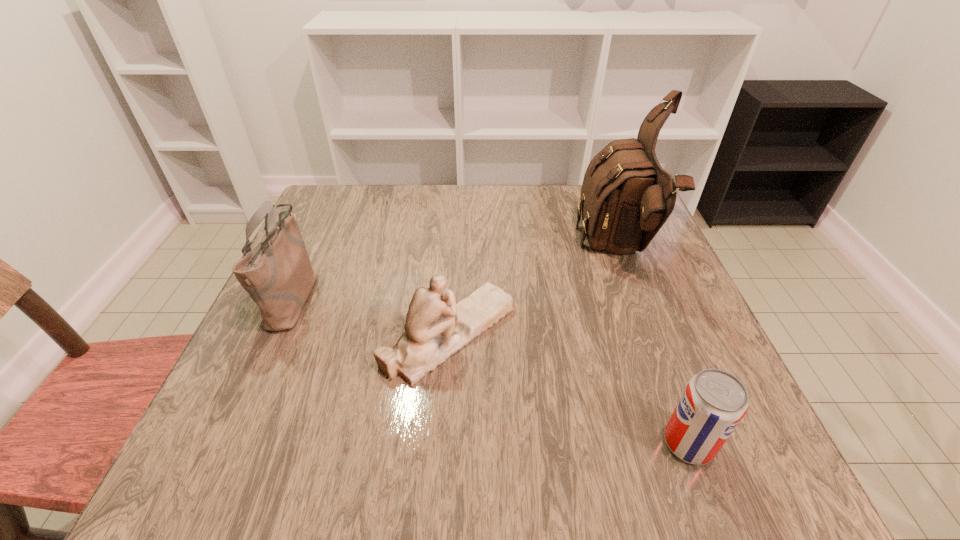
Find the location of `empty space between the taller shoulder bag and the soda`. empty space between the taller shoulder bag and the soda is located at coordinates (654, 347).

Identify the location of blank region between the nearest object and the figurine. The image size is (960, 540). (569, 388).

Where is `vacant area that lies between the nearest object and the left shoulder bag`? This screenshot has height=540, width=960. vacant area that lies between the nearest object and the left shoulder bag is located at coordinates (492, 370).

This screenshot has width=960, height=540. In order to click on vacant point located between the tallest object and the shorter shoulder bag in this screenshot , I will do `click(456, 273)`.

Where is `vacant area between the leftmost object and the nearest object`? The height and width of the screenshot is (540, 960). vacant area between the leftmost object and the nearest object is located at coordinates (492, 370).

Identify which object is the third nearest to the leftmost object. Please provide its 2D coordinates. Your answer should be formatted as a tuple, i.e. [(x, y)], where the tuple contains the x and y coordinates of a point satisfying the conditions above.

[(714, 401)]

Locate an element on the screen. The image size is (960, 540). object that is the third nearest to the third shortest object is located at coordinates (714, 401).

I want to click on free space that satisfies the following two spatial constraints: 1. on the front-facing side of the second object from left to right; 2. on the left side of the soda, so click(443, 443).

You are a GUI agent. You are given a task and a screenshot of the screen. Output one action in this format:
    pyautogui.click(x=<x>, y=<y>)
    Task: Click on the blank space that satisfies the following two spatial constraints: 1. on the front-facing side of the left shoulder bag; 2. on the right side of the nearest object
    The image size is (960, 540).
    Given the screenshot: What is the action you would take?
    pyautogui.click(x=229, y=443)

Identify the location of blank space that satisfies the following two spatial constraints: 1. on the front-facing side of the shorter shoulder bag; 2. on the left side of the soda. (229, 443).